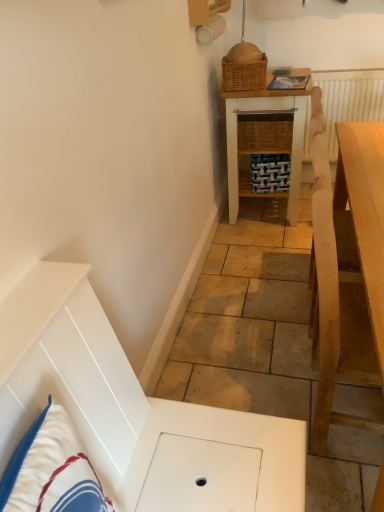
Question: Does woven wood table at center, which is counted as the second table, starting from the bottom, appear on the left side of woven brown picnic basket at upper center?

Choices:
 (A) yes
 (B) no

Answer: (B)

Question: Is woven wood table at center, the 2th table viewed from the front, behind woven brown picnic basket at upper center?

Choices:
 (A) yes
 (B) no

Answer: (A)

Question: Is woven wood table at center, which is the first table in back-to-front order, next to woven brown picnic basket at upper center?

Choices:
 (A) no
 (B) yes

Answer: (A)

Question: Considering the relative positions of woven wood table at center, the 1th table when ordered from top to bottom, and woven brown picnic basket at upper center in the image provided, is woven wood table at center, the 1th table when ordered from top to bottom, to the right of woven brown picnic basket at upper center from the viewer's perspective?

Choices:
 (A) no
 (B) yes

Answer: (B)

Question: Is woven brown picnic basket at upper center at the back of woven wood table at center, which is counted as the second table, starting from the bottom?

Choices:
 (A) no
 (B) yes

Answer: (A)

Question: Based on their positions, is white cotton pillow at lower left located to the left or right of light wood table at right, the second table positioned from the back?

Choices:
 (A) right
 (B) left

Answer: (B)

Question: From a real-world perspective, is white cotton pillow at lower left above or below light wood table at right, the second table positioned from the back?

Choices:
 (A) below
 (B) above

Answer: (B)

Question: Based on their sizes in the image, would you say white cotton pillow at lower left is bigger or smaller than light wood table at right, which is counted as the 2th table, starting from the top?

Choices:
 (A) small
 (B) big

Answer: (A)

Question: Considering the positions of point (72, 490) and point (337, 322), is point (72, 490) closer or farther from the camera than point (337, 322)?

Choices:
 (A) closer
 (B) farther

Answer: (A)

Question: Relative to light wood table at right, placed as the first table when sorted from front to back, is woven brown picnic basket at upper center in front or behind?

Choices:
 (A) front
 (B) behind

Answer: (B)

Question: Considering the positions of point (223, 69) and point (317, 164), is point (223, 69) closer or farther from the camera than point (317, 164)?

Choices:
 (A) farther
 (B) closer

Answer: (A)

Question: From the image's perspective, is woven brown picnic basket at upper center located above or below light wood table at right, the second table positioned from the back?

Choices:
 (A) below
 (B) above

Answer: (B)

Question: Is woven brown picnic basket at upper center wider or thinner than light wood table at right, placed as the first table when sorted from front to back?

Choices:
 (A) thin
 (B) wide

Answer: (A)

Question: In the image, is woven brown picnic basket at upper center positioned in front of or behind white cotton pillow at lower left?

Choices:
 (A) behind
 (B) front

Answer: (A)

Question: Is point (238, 49) positioned closer to the camera than point (69, 430)?

Choices:
 (A) closer
 (B) farther

Answer: (B)